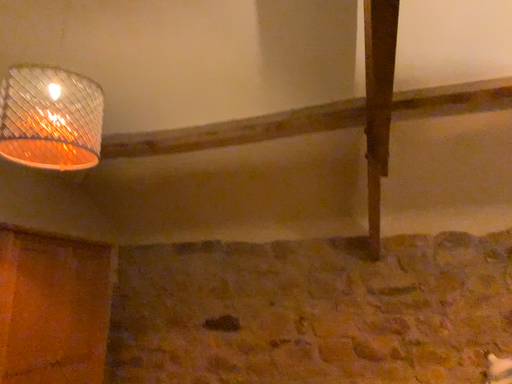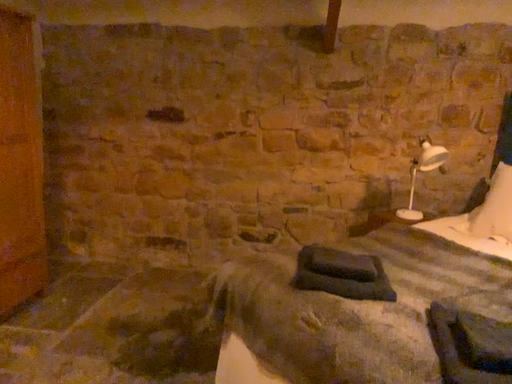
Question: Which way did the camera rotate in the video?

Choices:
 (A) rotated right
 (B) rotated left

Answer: (A)